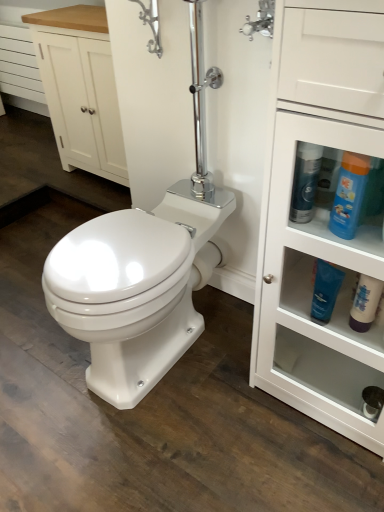
I want to click on vacant space situated on the left part of white wood cabinet at upper left, so 36,179.